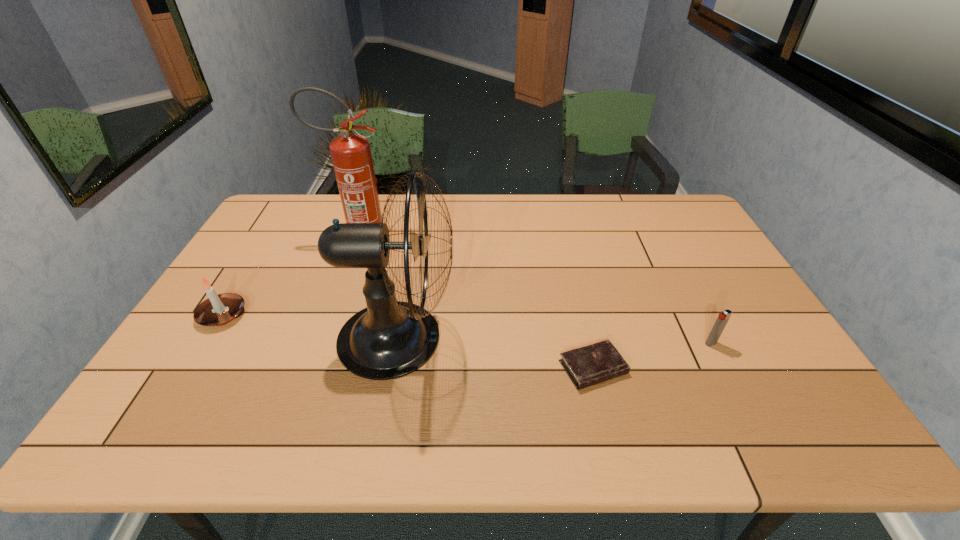
Identify the location of blank area located 0.310m on the front of the leftmost object. (146, 441).

Where is `vacant area situated on the front of the second shortest object`? The width and height of the screenshot is (960, 540). vacant area situated on the front of the second shortest object is located at coordinates (742, 404).

The image size is (960, 540). Identify the location of vacant space located on the back of the shortest object. (571, 277).

The image size is (960, 540). Find the location of `object that is at the far edge`. object that is at the far edge is located at coordinates (351, 156).

Locate an element on the screen. The height and width of the screenshot is (540, 960). object positioned at the left edge is located at coordinates (217, 310).

This screenshot has width=960, height=540. Find the location of `blank space at the far edge of the desktop`. blank space at the far edge of the desktop is located at coordinates pos(330,221).

I want to click on free space at the near edge of the desktop, so click(691, 430).

Where is `vacant region at the left edge`? The width and height of the screenshot is (960, 540). vacant region at the left edge is located at coordinates coord(224,353).

The height and width of the screenshot is (540, 960). I want to click on vacant space at the right edge, so click(736, 321).

Locate an element on the screen. This screenshot has height=540, width=960. free area in between the fan and the diary is located at coordinates (495, 353).